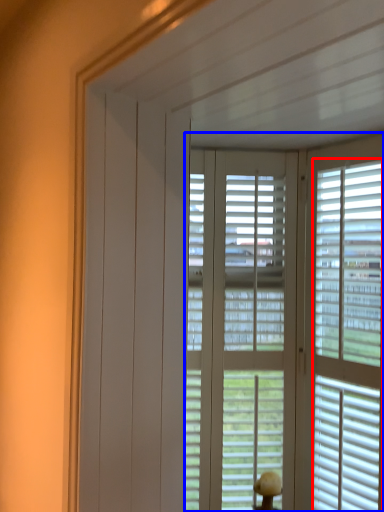
Question: Which object appears farthest to the camera in this image, blind (highlighted by a red box) or window blind (highlighted by a blue box)?

Choices:
 (A) blind
 (B) window blind

Answer: (B)